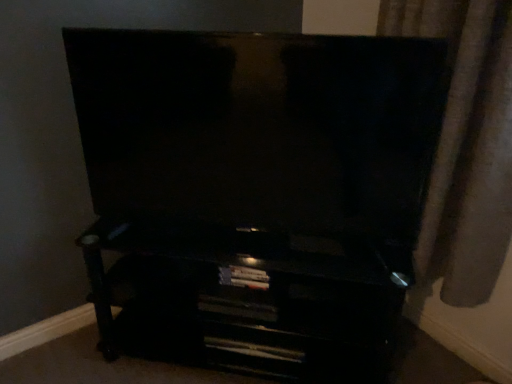
Question: Can we say satin beige curtain at right lies outside black glossy entertainment center at lower center?

Choices:
 (A) yes
 (B) no

Answer: (A)

Question: Is satin beige curtain at right facing towards black glossy entertainment center at lower center?

Choices:
 (A) yes
 (B) no

Answer: (A)

Question: From a real-world perspective, does satin beige curtain at right sit lower than black glossy entertainment center at lower center?

Choices:
 (A) no
 (B) yes

Answer: (A)

Question: Can you confirm if satin beige curtain at right is positioned to the right of black glossy entertainment center at lower center?

Choices:
 (A) no
 (B) yes

Answer: (B)

Question: Is satin beige curtain at right surrounding black glossy entertainment center at lower center?

Choices:
 (A) no
 (B) yes

Answer: (A)

Question: Is black glossy entertainment center at lower center situated inside satin beige curtain at right or outside?

Choices:
 (A) inside
 (B) outside

Answer: (B)

Question: From a real-world perspective, is black glossy entertainment center at lower center physically located above or below satin beige curtain at right?

Choices:
 (A) above
 (B) below

Answer: (B)

Question: Considering the positions of black glossy entertainment center at lower center and satin beige curtain at right in the image, is black glossy entertainment center at lower center wider or thinner than satin beige curtain at right?

Choices:
 (A) wide
 (B) thin

Answer: (A)

Question: From the image's perspective, is black glossy entertainment center at lower center located above or below satin beige curtain at right?

Choices:
 (A) above
 (B) below

Answer: (B)

Question: In terms of size, does matte black tv at center appear bigger or smaller than black glossy entertainment center at lower center?

Choices:
 (A) big
 (B) small

Answer: (B)

Question: Relative to black glossy entertainment center at lower center, is matte black tv at center in front or behind?

Choices:
 (A) front
 (B) behind

Answer: (A)

Question: In terms of width, does matte black tv at center look wider or thinner when compared to black glossy entertainment center at lower center?

Choices:
 (A) thin
 (B) wide

Answer: (A)

Question: Is point (175, 100) closer or farther from the camera than point (150, 254)?

Choices:
 (A) farther
 (B) closer

Answer: (B)

Question: In terms of width, does matte black tv at center look wider or thinner when compared to satin beige curtain at right?

Choices:
 (A) wide
 (B) thin

Answer: (B)

Question: Is point (439, 54) closer or farther from the camera than point (468, 274)?

Choices:
 (A) closer
 (B) farther

Answer: (A)